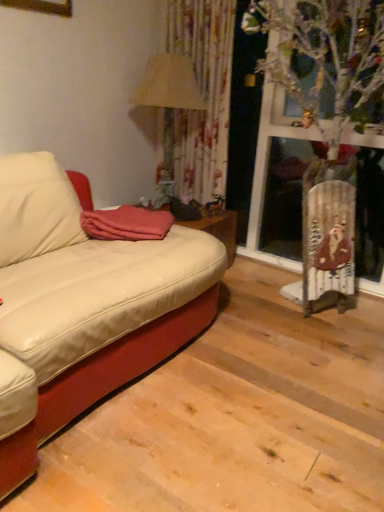
Question: Is coral fleece blanket at center bigger or smaller than beige fabric lampshade at upper center?

Choices:
 (A) small
 (B) big

Answer: (A)

Question: Is coral fleece blanket at center spatially inside beige fabric lampshade at upper center, or outside of it?

Choices:
 (A) inside
 (B) outside

Answer: (B)

Question: Considering the relative positions of coral fleece blanket at center and beige fabric lampshade at upper center in the image provided, is coral fleece blanket at center to the left or to the right of beige fabric lampshade at upper center?

Choices:
 (A) left
 (B) right

Answer: (A)

Question: From the image's perspective, relative to coral fleece blanket at center, is beige fabric lampshade at upper center above or below?

Choices:
 (A) below
 (B) above

Answer: (B)

Question: Is point (147, 104) positioned closer to the camera than point (120, 221)?

Choices:
 (A) farther
 (B) closer

Answer: (A)

Question: In terms of height, does beige fabric lampshade at upper center look taller or shorter compared to coral fleece blanket at center?

Choices:
 (A) short
 (B) tall

Answer: (B)

Question: Relative to coral fleece blanket at center, is beige fabric lampshade at upper center in front or behind?

Choices:
 (A) behind
 (B) front

Answer: (A)